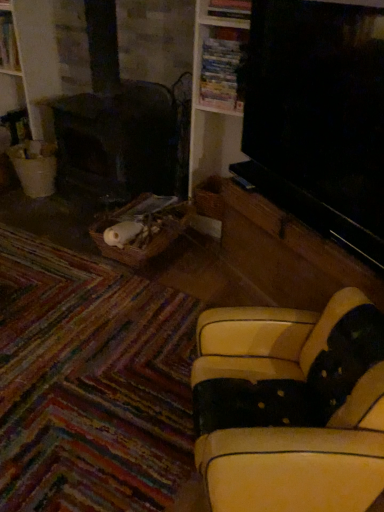
Question: Is wooden bookshelf at upper center taller than white painted wood bookshelf at upper left?

Choices:
 (A) yes
 (B) no

Answer: (B)

Question: From the image's perspective, is wooden bookshelf at upper center located above white painted wood bookshelf at upper left?

Choices:
 (A) yes
 (B) no

Answer: (B)

Question: Is wooden bookshelf at upper center not inside white painted wood bookshelf at upper left?

Choices:
 (A) yes
 (B) no

Answer: (A)

Question: Does wooden bookshelf at upper center have a smaller size compared to white painted wood bookshelf at upper left?

Choices:
 (A) yes
 (B) no

Answer: (A)

Question: Is wooden bookshelf at upper center oriented towards white painted wood bookshelf at upper left?

Choices:
 (A) no
 (B) yes

Answer: (A)

Question: Considering the relative positions of wooden bookshelf at upper center and white painted wood bookshelf at upper left in the image provided, is wooden bookshelf at upper center behind white painted wood bookshelf at upper left?

Choices:
 (A) no
 (B) yes

Answer: (A)

Question: Is the surface of leather-like yellow couch at lower right in direct contact with wooden bookshelf at upper center?

Choices:
 (A) yes
 (B) no

Answer: (B)

Question: Are leather-like yellow couch at lower right and wooden bookshelf at upper center located far from each other?

Choices:
 (A) no
 (B) yes

Answer: (B)

Question: From a real-world perspective, is leather-like yellow couch at lower right under wooden bookshelf at upper center?

Choices:
 (A) no
 (B) yes

Answer: (B)

Question: Is leather-like yellow couch at lower right facing away from wooden bookshelf at upper center?

Choices:
 (A) no
 (B) yes

Answer: (A)

Question: From the image's perspective, is leather-like yellow couch at lower right on top of wooden bookshelf at upper center?

Choices:
 (A) yes
 (B) no

Answer: (B)

Question: Is leather-like yellow couch at lower right to the right of wooden bookshelf at upper center from the viewer's perspective?

Choices:
 (A) yes
 (B) no

Answer: (A)

Question: Considering the relative sizes of wooden bookshelf at upper center and leather-like yellow couch at lower right in the image provided, is wooden bookshelf at upper center shorter than leather-like yellow couch at lower right?

Choices:
 (A) no
 (B) yes

Answer: (B)